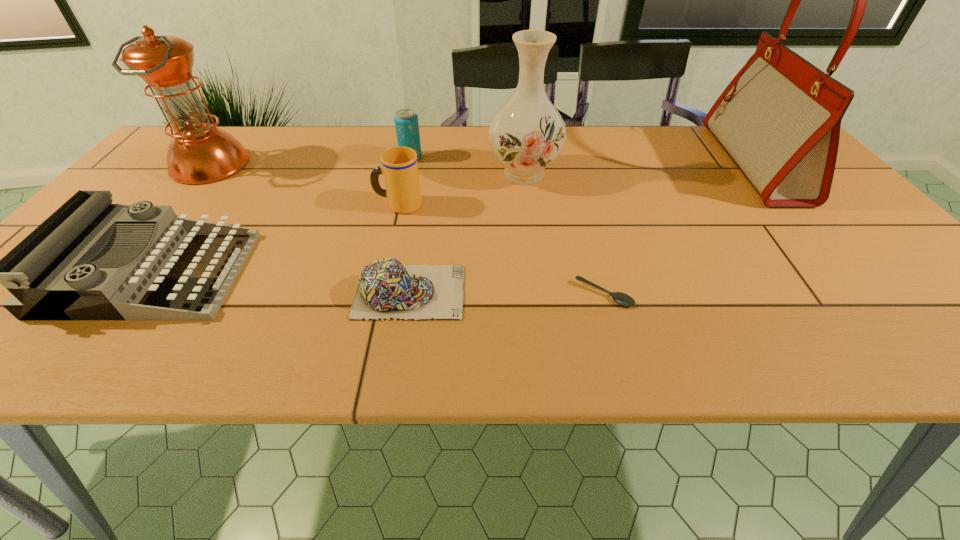
Locate an element on the screen. oil lamp at the far edge is located at coordinates (199, 152).

Where is `vase at the far edge`? Image resolution: width=960 pixels, height=540 pixels. vase at the far edge is located at coordinates (527, 133).

Find the location of a particular element. The width and height of the screenshot is (960, 540). soda can positioned at the far edge is located at coordinates (406, 120).

Where is `object positioned at the near edge`? The image size is (960, 540). object positioned at the near edge is located at coordinates (47, 273).

Where is `oil lamp that is positioned at the left edge`? Image resolution: width=960 pixels, height=540 pixels. oil lamp that is positioned at the left edge is located at coordinates (199, 152).

The width and height of the screenshot is (960, 540). In order to click on typewriter that is at the left edge in this screenshot , I will do `click(47, 273)`.

You are a GUI agent. You are given a task and a screenshot of the screen. Output one action in this format:
    pyautogui.click(x=<x>, y=<y>)
    Task: Click on the object present at the right edge
    The width and height of the screenshot is (960, 540).
    Given the screenshot: What is the action you would take?
    pyautogui.click(x=779, y=119)

Where is `object located at the far left corner`? This screenshot has height=540, width=960. object located at the far left corner is located at coordinates (199, 152).

Where is `object located in the near left corner section of the desktop`? The image size is (960, 540). object located in the near left corner section of the desktop is located at coordinates (47, 273).

Find the location of a particular element. The height and width of the screenshot is (540, 960). object that is positioned at the far right corner is located at coordinates (779, 119).